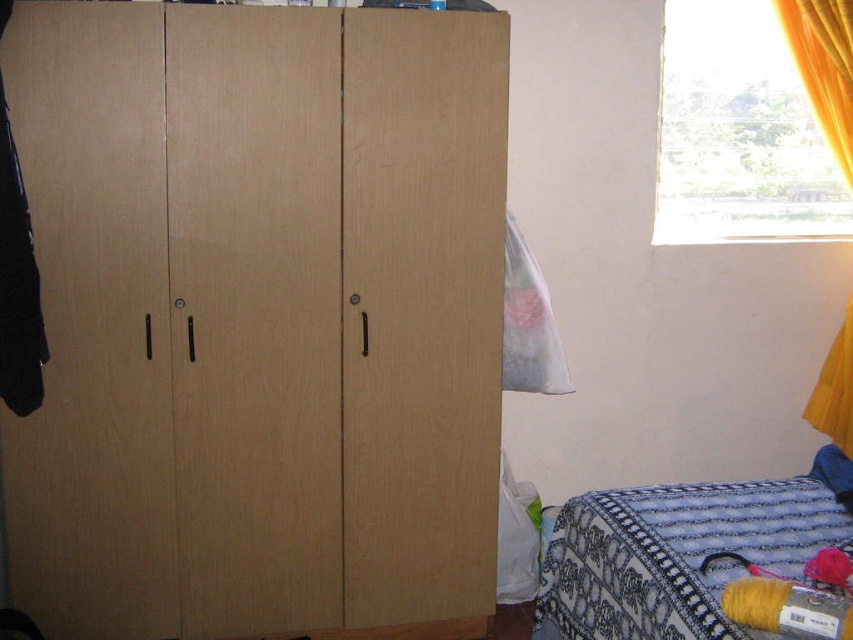
Question: Is blue knitted blanket at lower right wider than yellow fabric curtain at upper right?

Choices:
 (A) yes
 (B) no

Answer: (A)

Question: Is light brown wood dresser at left further to camera compared to yellow curtain at upper right?

Choices:
 (A) no
 (B) yes

Answer: (A)

Question: Among these objects, which one is farthest from the camera?

Choices:
 (A) translucent plastic bag at upper right
 (B) blue knitted blanket at lower right
 (C) yellow curtain at upper right
 (D) yellow fabric curtain at upper right

Answer: (C)

Question: Does blue knitted blanket at lower right lie behind yellow fabric curtain at upper right?

Choices:
 (A) no
 (B) yes

Answer: (A)

Question: Considering the real-world distances, which object is closest to the translucent plastic bag at upper right?

Choices:
 (A) light brown wood dresser at left
 (B) yellow curtain at upper right
 (C) blue knitted blanket at lower right

Answer: (A)

Question: Which is farther from the blue knitted blanket at lower right?

Choices:
 (A) yellow fabric curtain at upper right
 (B) translucent plastic bag at upper right
 (C) yellow curtain at upper right

Answer: (A)